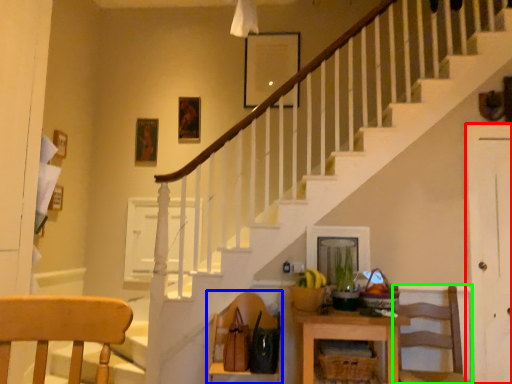
Question: Based on their relative distances, which object is farther from door (highlighted by a red box)? Choose from chair (highlighted by a blue box) and chair (highlighted by a green box).

Choices:
 (A) chair
 (B) chair

Answer: (A)